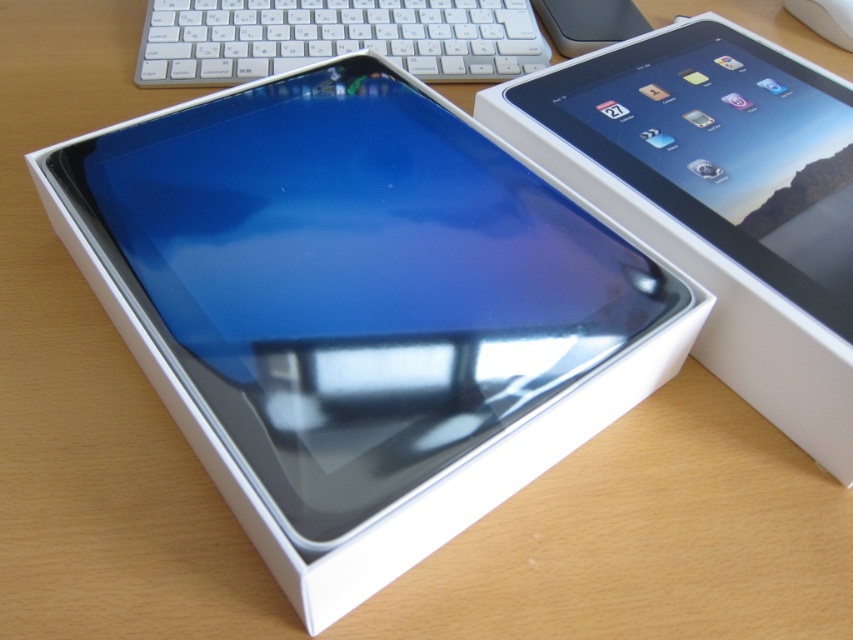
Question: Does satin black tablet at center appear under satin black tablet at upper right?

Choices:
 (A) no
 (B) yes

Answer: (B)

Question: Is satin black tablet at center positioned before satin black tablet at upper right?

Choices:
 (A) no
 (B) yes

Answer: (B)

Question: Which point appears closest to the camera in this image?

Choices:
 (A) (229, 29)
 (B) (663, 317)

Answer: (B)

Question: Observing the image, what is the correct spatial positioning of satin black tablet at center in reference to white plastic keyboard at upper center?

Choices:
 (A) above
 (B) below

Answer: (B)

Question: Estimate the real-world distances between objects in this image. Which object is closer to the satin black tablet at center?

Choices:
 (A) white plastic keyboard at upper center
 (B) satin black tablet at upper right

Answer: (B)

Question: Which object is positioned farthest from the white plastic mouse at upper right?

Choices:
 (A) white plastic keyboard at upper center
 (B) satin black tablet at upper right

Answer: (A)